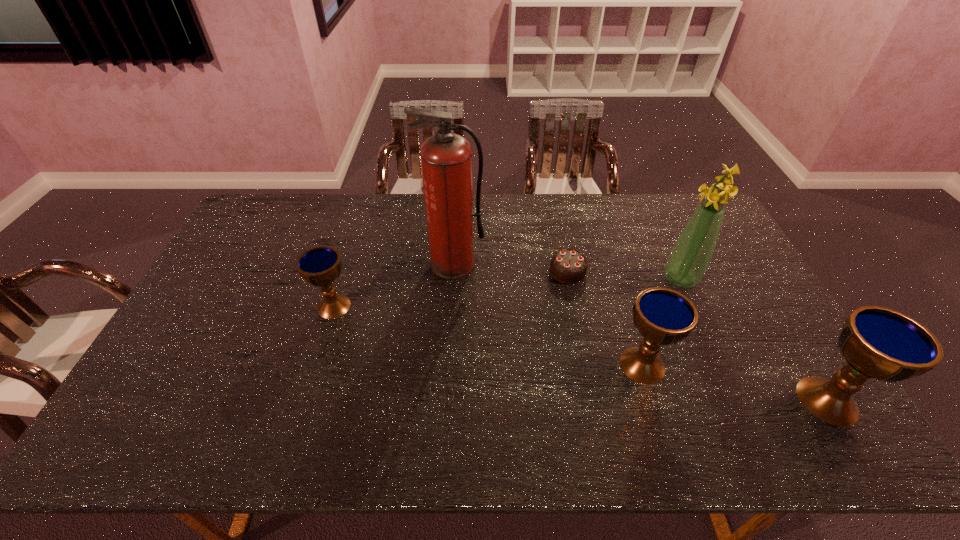
Locate an element on the screen. This screenshot has height=540, width=960. the leftmost chalice is located at coordinates click(320, 266).

I want to click on the leftmost object, so click(x=320, y=266).

Identify the location of the third object from right to left. (663, 316).

At what (x,y) coordinates should I click in order to perform the action: click on the second shortest chalice. Please return your answer as a coordinate pair (x, y). Looking at the image, I should click on (663, 316).

This screenshot has width=960, height=540. Identify the location of the rightmost chalice. (877, 342).

Where is `bouquet`? The width and height of the screenshot is (960, 540). bouquet is located at coordinates tap(690, 257).

At what (x,y) coordinates should I click in order to perform the action: click on the fifth shortest object. Please return your answer as a coordinate pair (x, y). Looking at the image, I should click on (690, 257).

Where is `the shortest object`? the shortest object is located at coordinates (569, 266).

This screenshot has height=540, width=960. I want to click on chocolate cake, so click(569, 266).

The image size is (960, 540). What are the coordinates of `fire extinguisher` in the screenshot? It's located at click(x=446, y=158).